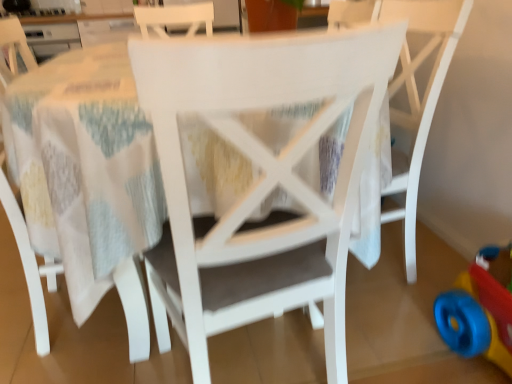
Question: Looking at the image, does white matte chair at center, which is the second chair from left to right, seem bigger or smaller compared to rubberized plastic toy at lower right?

Choices:
 (A) big
 (B) small

Answer: (A)

Question: Is point (263, 162) positioned closer to the camera than point (510, 322)?

Choices:
 (A) closer
 (B) farther

Answer: (A)

Question: Which of these objects is positioned closest to the white matte chair at center, which ranks as the third chair in right-to-left order?

Choices:
 (A) rubberized plastic toy at lower right
 (B) white matte chair at center, the 1th chair positioned from the right
 (C) white matte chair at center, which is the 2th chair in right-to-left order

Answer: (C)

Question: Which object is the closest to the white matte chair at center, which ranks as the third chair in right-to-left order?

Choices:
 (A) rubberized plastic toy at lower right
 (B) white matte chair at center, which is the 2th chair in right-to-left order
 (C) white matte chair at center, the 1th chair positioned from the right

Answer: (B)